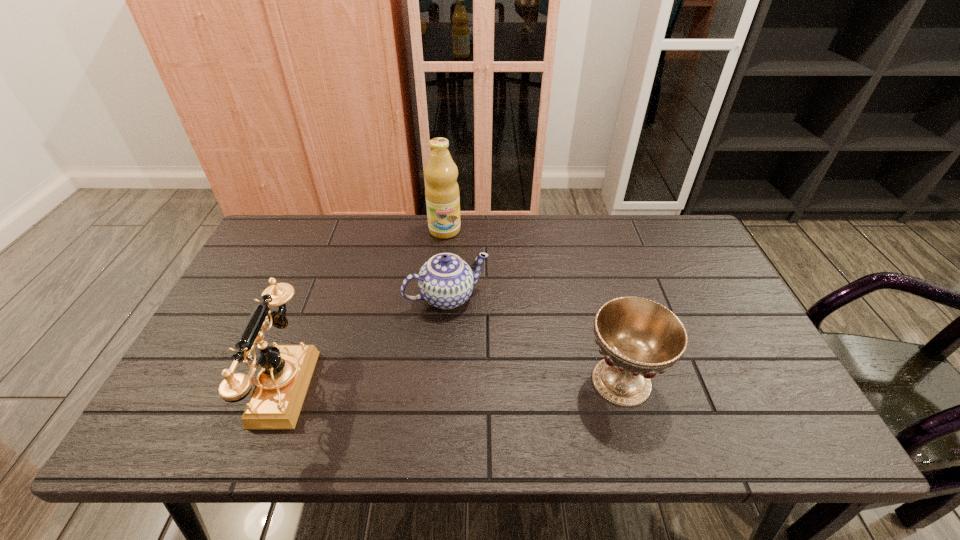
Locate an element on the screen. This screenshot has height=540, width=960. vacant space at the far edge of the desktop is located at coordinates (564, 247).

Identify the location of free point at the near edge. The height and width of the screenshot is (540, 960). (317, 393).

Where is `free space at the left edge`? free space at the left edge is located at coordinates (268, 287).

This screenshot has height=540, width=960. In order to click on vacant space at the right edge of the desktop in this screenshot , I will do `click(684, 275)`.

In the image, there is a desktop. At what (x,y) coordinates should I click in order to perform the action: click on vacant region at the far left corner. Please return your answer as a coordinate pair (x, y). The width and height of the screenshot is (960, 540). Looking at the image, I should click on (268, 234).

Image resolution: width=960 pixels, height=540 pixels. Find the location of `blank space at the far right corner of the desktop`. blank space at the far right corner of the desktop is located at coordinates (668, 244).

The image size is (960, 540). Identify the location of vacant space in between the second farthest object and the second tallest object. (364, 341).

Find the location of a particular element. vacant space that's between the farthest object and the rightmost object is located at coordinates (533, 306).

This screenshot has width=960, height=540. I want to click on vacant space that is in between the chalice and the olive oil, so click(x=533, y=306).

Identify the location of free area in between the second shortest object and the chinaware. The image size is (960, 540). (535, 339).